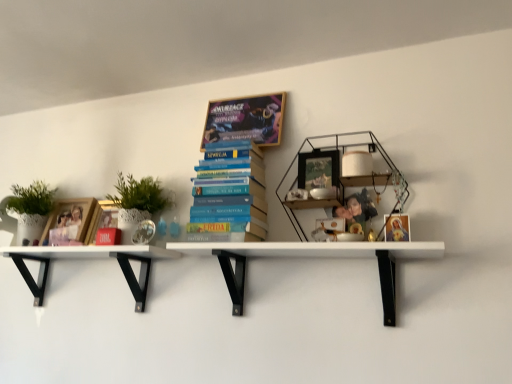
Question: Is matte black picture frame at center aimed at white matte shelf at lower left, which is the second shelf in right-to-left order?

Choices:
 (A) no
 (B) yes

Answer: (A)

Question: Is matte black picture frame at center to the left of white matte shelf at lower left, acting as the 1th shelf starting from the left, from the viewer's perspective?

Choices:
 (A) no
 (B) yes

Answer: (A)

Question: Is matte black picture frame at center next to white matte shelf at lower left, which is the second shelf in right-to-left order, and touching it?

Choices:
 (A) no
 (B) yes

Answer: (A)

Question: Is matte black picture frame at center bigger than white matte shelf at lower left, acting as the 1th shelf starting from the left?

Choices:
 (A) no
 (B) yes

Answer: (A)

Question: Is white matte shelf at lower left, which is the second shelf in right-to-left order, at the back of matte black picture frame at center?

Choices:
 (A) yes
 (B) no

Answer: (B)

Question: Relative to white matte shelf at center, which is counted as the first shelf, starting from the right, is matte cardboard book at upper center, marked as the 1th book in a top-to-bottom arrangement, in front or behind?

Choices:
 (A) front
 (B) behind

Answer: (B)

Question: Is point (269, 129) positioned closer to the camera than point (244, 251)?

Choices:
 (A) closer
 (B) farther

Answer: (B)

Question: From the image's perspective, is matte cardboard book at upper center, the second book in the bottom-to-top sequence, located above or below white matte shelf at center, which is the second shelf from left to right?

Choices:
 (A) above
 (B) below

Answer: (A)

Question: From a real-world perspective, is matte cardboard book at upper center, the second book in the bottom-to-top sequence, physically located above or below white matte shelf at center, which is the second shelf from left to right?

Choices:
 (A) above
 (B) below

Answer: (A)

Question: Is woodenmaterial/texturebookcase at upper right bigger or smaller than matte gold frame at upper right, marked as the 1th book cover in a right-to-left arrangement?

Choices:
 (A) big
 (B) small

Answer: (A)

Question: From the image's perspective, is woodenmaterial/texturebookcase at upper right above or below matte gold frame at upper right, marked as the 1th book cover in a right-to-left arrangement?

Choices:
 (A) above
 (B) below

Answer: (A)

Question: From a real-world perspective, is woodenmaterial/texturebookcase at upper right above or below matte gold frame at upper right, marked as the 2th book cover in a back-to-front arrangement?

Choices:
 (A) above
 (B) below

Answer: (A)

Question: Is woodenmaterial/texturebookcase at upper right inside or outside of matte gold frame at upper right, marked as the 2th book cover in a back-to-front arrangement?

Choices:
 (A) outside
 (B) inside

Answer: (A)

Question: In terms of height, does matte wooden frame at left, placed as the 1th book cover when sorted from back to front, look taller or shorter compared to white matte shelf at lower left, acting as the 1th shelf starting from the left?

Choices:
 (A) tall
 (B) short

Answer: (B)

Question: Considering the positions of matte wooden frame at left, arranged as the 2th book cover when viewed from the front, and white matte shelf at lower left, acting as the 1th shelf starting from the left, in the image, is matte wooden frame at left, arranged as the 2th book cover when viewed from the front, wider or thinner than white matte shelf at lower left, acting as the 1th shelf starting from the left,?

Choices:
 (A) wide
 (B) thin

Answer: (B)